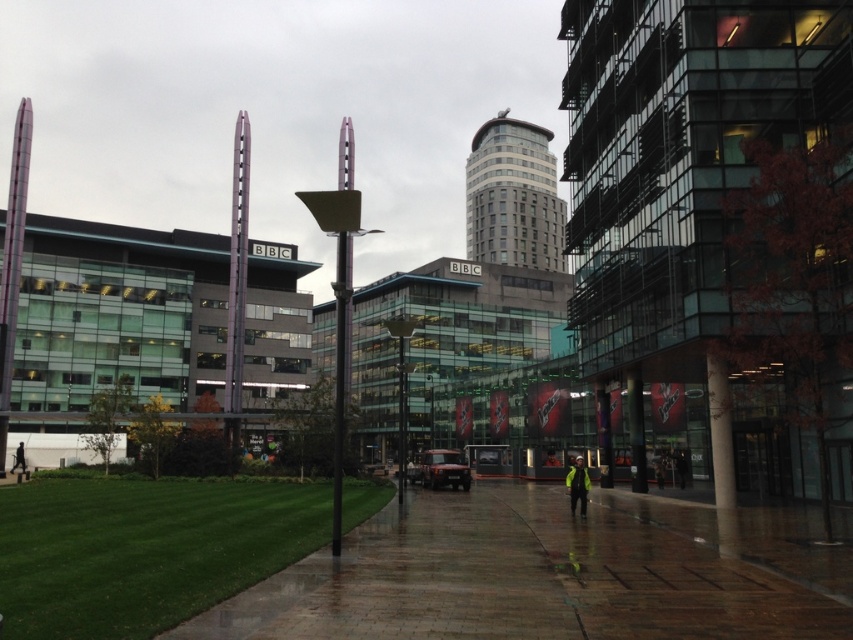
Can you confirm if high visibility yellow jacket at center is positioned to the left of black jacket at lower left?

No, high visibility yellow jacket at center is not to the left of black jacket at lower left.

The height and width of the screenshot is (640, 853). Find the location of `high visibility yellow jacket at center`. high visibility yellow jacket at center is located at coordinates (577, 484).

Can you confirm if shiny brick pavement at center is bigger than high visibility yellow jacket at center?

Actually, shiny brick pavement at center might be smaller than high visibility yellow jacket at center.

Is point (805, 564) positioned before point (569, 502)?

Yes.

Locate an element on the screen. Image resolution: width=853 pixels, height=640 pixels. shiny brick pavement at center is located at coordinates (554, 573).

Can you confirm if shiny brick pavement at center is taller than black jacket at lower left?

Correct, shiny brick pavement at center is much taller as black jacket at lower left.

Does shiny brick pavement at center have a larger size compared to black jacket at lower left?

Yes.

Where is `shiny brick pavement at center`? This screenshot has width=853, height=640. shiny brick pavement at center is located at coordinates (554, 573).